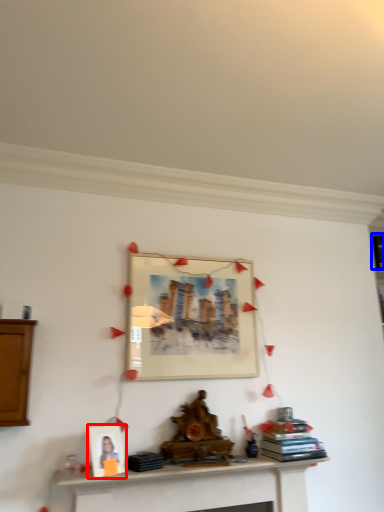
Question: Which object appears farthest to the camera in this image, picture frame (highlighted by a red box) or book (highlighted by a blue box)?

Choices:
 (A) picture frame
 (B) book

Answer: (B)